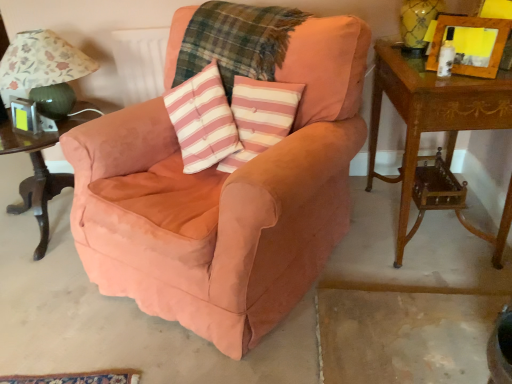
I want to click on free point below wooden carved side table at right, the first table viewed from the right (from a real-world perspective), so click(x=430, y=230).